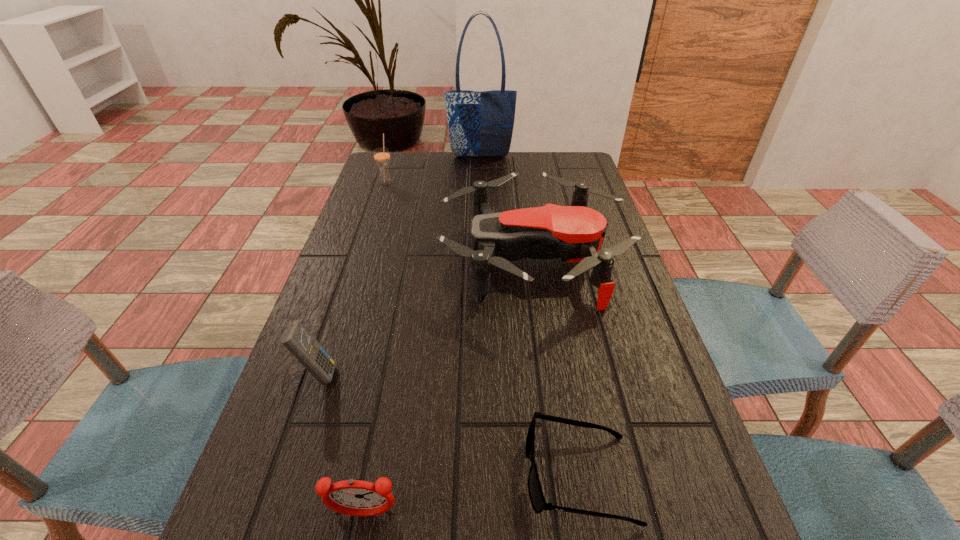
This screenshot has width=960, height=540. In order to click on shopping bag in this screenshot , I will do tap(481, 124).

Find the location of a particular element. the farthest object is located at coordinates (481, 124).

Locate an element on the screen. straw is located at coordinates click(381, 155).

The height and width of the screenshot is (540, 960). Find the location of `drone`. drone is located at coordinates (575, 233).

Where is `calculator`? The image size is (960, 540). calculator is located at coordinates (302, 345).

Find the location of a particular element. This screenshot has height=540, width=960. the fourth object from right to left is located at coordinates (351, 497).

At what (x,y) coordinates should I click in order to perform the action: click on sunglasses. Please return your answer as a coordinate pair (x, y). Looking at the image, I should click on (536, 495).

This screenshot has height=540, width=960. What are the coordinates of `free location located on the front-facing side of the shopping bag` in the screenshot? It's located at (481, 166).

Where is `vacant point located on the back of the straw`? The width and height of the screenshot is (960, 540). vacant point located on the back of the straw is located at coordinates (393, 164).

Identify the location of vacant region located 0.080m on the camera side of the drone. The width and height of the screenshot is (960, 540). (409, 260).